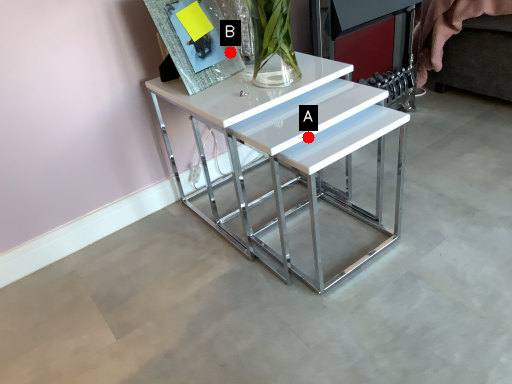
Question: Two points are circled on the image, labeled by A and B beside each circle. Which point is farther from the camera taking this photo?

Choices:
 (A) A is further
 (B) B is further

Answer: (B)